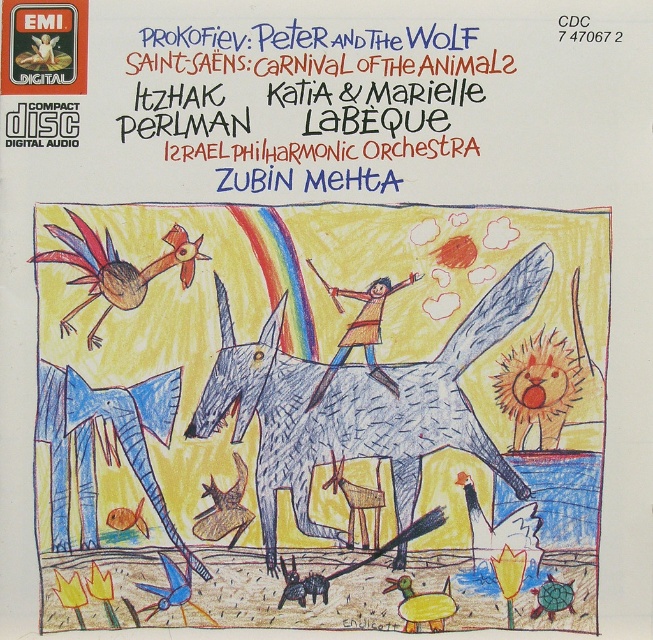
You are designing a digital album cover and need to place a new element exactly where the blue ink text at upper center is located. What are the coordinates of this position?

The coordinates of the blue ink text at upper center are at point (315,100).

Looking at the album cover for classical music recordings, you notice the blue ink text at upper center and the colored pencil rooster at upper left. Which of these two elements is bigger in size?

The blue ink text at upper center is larger in size compared to the colored pencil rooster at upper left.

You are designing a layout for the album cover and need to place a new element. The blue ink text at upper center is located at point (315,100). Where should you place the new element to avoid overlapping with it?

Place the new element away from the coordinates (315,100) to avoid overlapping with the blue ink text at upper center.